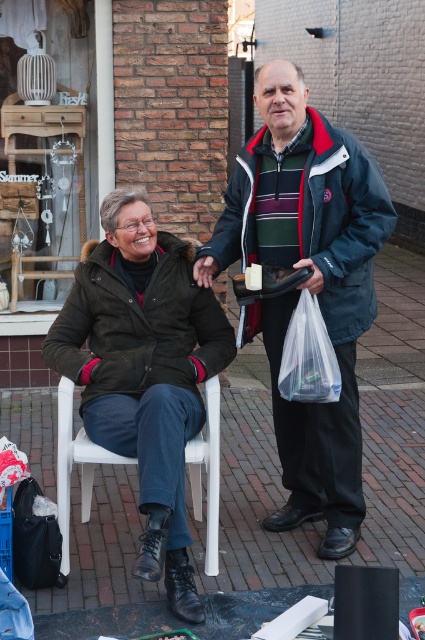
Question: Is dark blue jacket at center above matte black jacket at center?

Choices:
 (A) yes
 (B) no

Answer: (A)

Question: Does dark blue jacket at center have a larger size compared to matte black bag at lower left?

Choices:
 (A) yes
 (B) no

Answer: (A)

Question: Which object is closer to the camera taking this photo?

Choices:
 (A) matte black bag at lower left
 (B) dark blue jacket at center
 (C) white plastic chair at lower left
 (D) matte black jacket at center

Answer: (D)

Question: Does dark blue jacket at center appear on the right side of matte black bag at lower left?

Choices:
 (A) no
 (B) yes

Answer: (B)

Question: Considering the real-world distances, which object is closest to the matte black jacket at center?

Choices:
 (A) matte black bag at lower left
 (B) dark blue jacket at center
 (C) white plastic chair at lower left

Answer: (C)

Question: Estimate the real-world distances between objects in this image. Which object is farther from the white plastic chair at lower left?

Choices:
 (A) matte black jacket at center
 (B) matte black bag at lower left

Answer: (A)